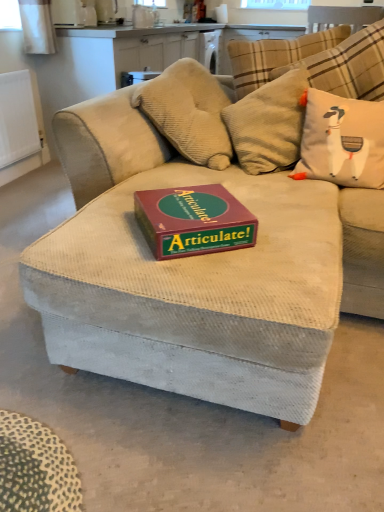
From a real-world perspective, locate any blank space above maroon cardboard articulate! game box on the center in the image.

[(195, 204)]